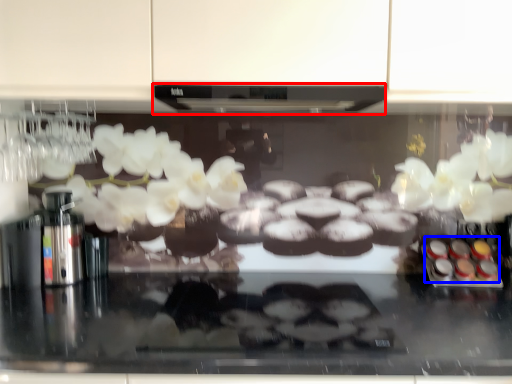
Question: Which of the following is the closest to the observer, exhaust hood (highlighted by a red box) or food (highlighted by a blue box)?

Choices:
 (A) exhaust hood
 (B) food

Answer: (A)